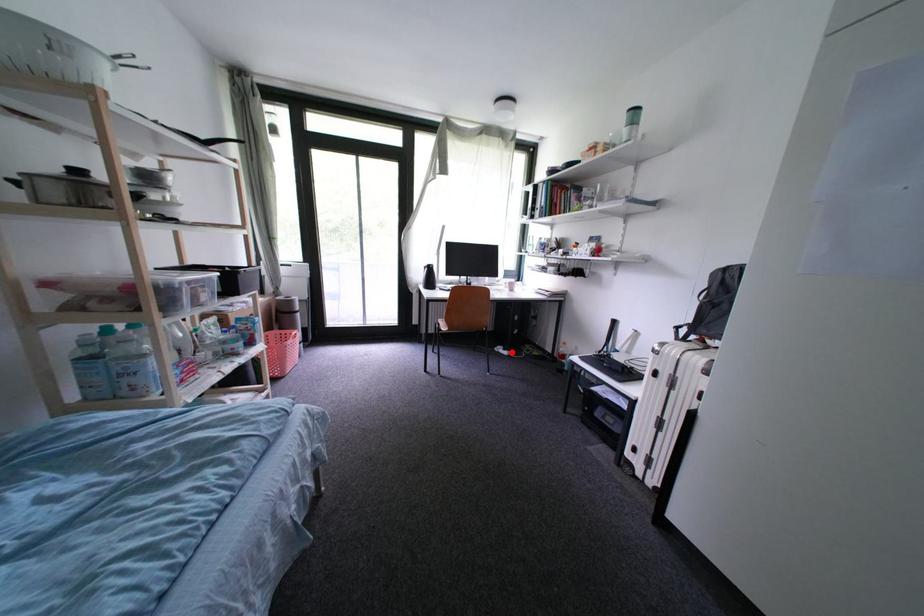
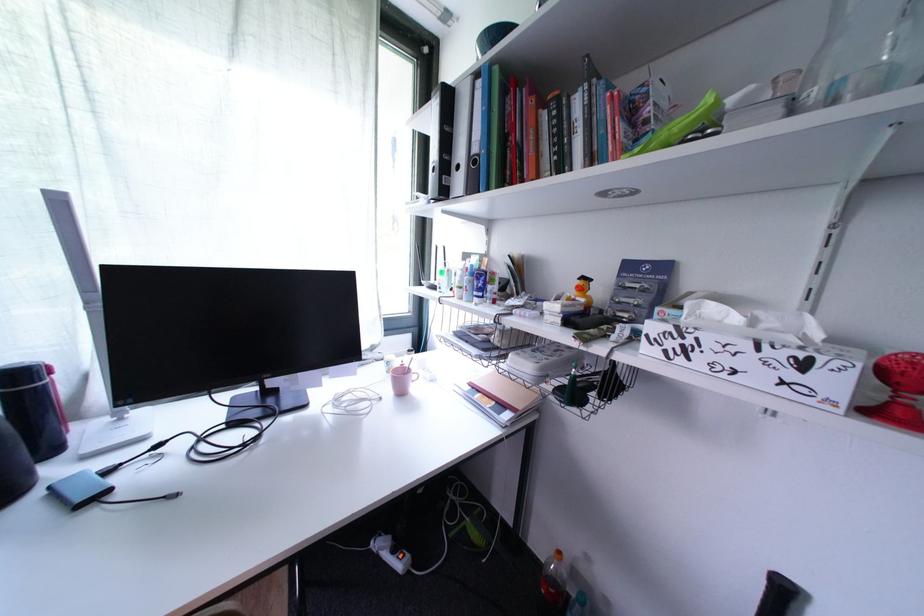
In the second image, find the point that corresponds to the highlighted location in the first image.

(402, 553)